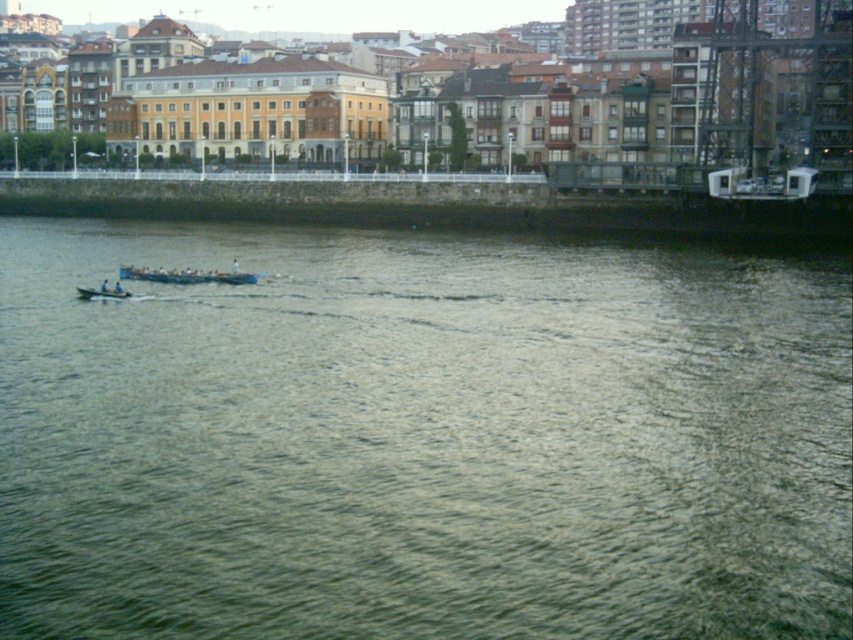
Who is more distant from viewer, (125, 330) or (122, 298)?

The point (122, 298) is more distant.

This screenshot has height=640, width=853. What are the coordinates of `green water at lower left` in the screenshot? It's located at (419, 436).

Is point (489, 573) closer to camera compared to point (90, 292)?

Yes, point (489, 573) is closer to viewer.

Identify the location of green water at lower left. The image size is (853, 640). (419, 436).

Which of these two, green water at lower left or blue glossy rowboat at center, stands shorter?

Standing shorter between the two is blue glossy rowboat at center.

Is point (726, 328) positioned behind point (221, 275)?

No, (726, 328) is in front of (221, 275).

This screenshot has height=640, width=853. What do you see at coordinates (419, 436) in the screenshot?
I see `green water at lower left` at bounding box center [419, 436].

Where is `green water at lower left`? The image size is (853, 640). green water at lower left is located at coordinates (419, 436).

Between blue glossy rowboat at center and blue plastic boat at center, which one has more height?

Standing taller between the two is blue glossy rowboat at center.

From the picture: Is blue glossy rowboat at center positioned in front of blue plastic boat at center?

No, it is not.

Is point (212, 282) farther from camera compared to point (125, 292)?

Yes, it is.

Locate an element on the screen. blue glossy rowboat at center is located at coordinates (x=184, y=275).